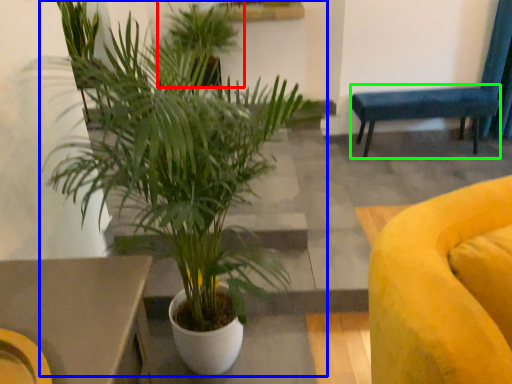
Question: Which object is positioned farthest from houseplant (highlighted by a red box)? Select from houseplant (highlighted by a blue box) and armchair (highlighted by a green box).

Choices:
 (A) houseplant
 (B) armchair

Answer: (A)